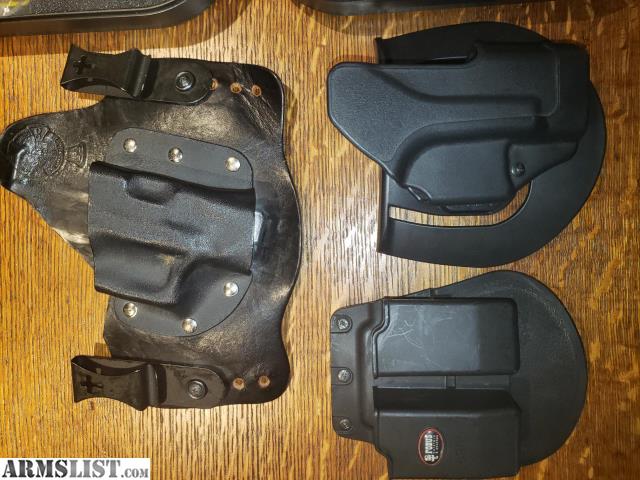
Identify the location of embossing on the leather. (59, 156).